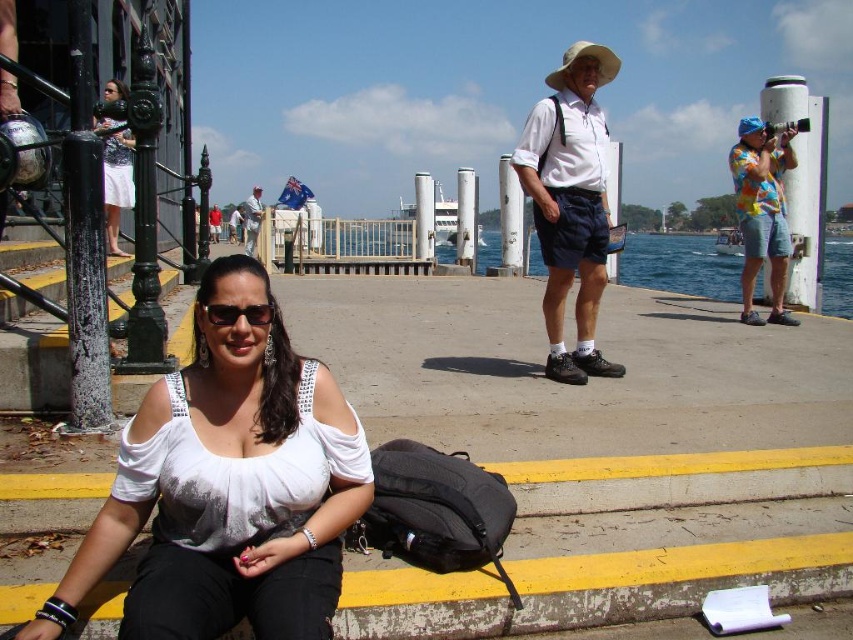
You are standing at the waterfront and see the black reflective sunglasses at center. If you want to locate them precisely, what are their coordinates?

The black reflective sunglasses at center are located at coordinates point (238, 314).

You are observing a group of people at the waterfront. You notice a multicolored fabric shirt at right and a white shirt at center. Which of these two shirts is shorter in height?

The multicolored fabric shirt at right has a lesser height compared to the white shirt at center, so the multicolored fabric shirt at right is shorter in height.

You are a fashion designer analyzing the outfit of a woman in the image. Which item takes up more visual space in her outfit, the black reflective sunglasses at center or the white shirt at center?

The white shirt at center takes up more visual space than the black reflective sunglasses at center.